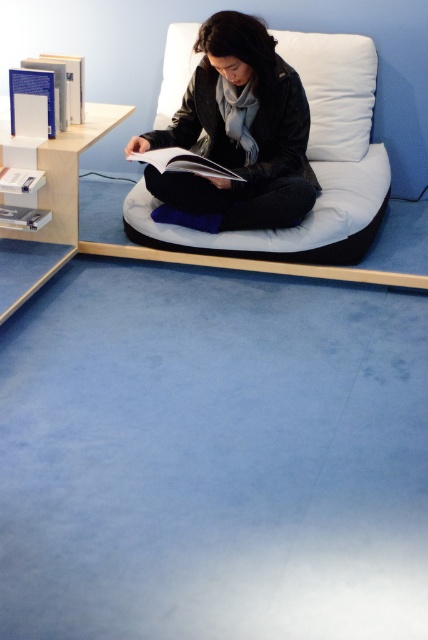
You are organizing a bookshelf and want to place the blue hardcover book at upper left and the white paper book at left. Which book should you place first if you want to arrange them from tallest to shortest?

You should place the blue hardcover book at upper left first because it is much taller than the white paper book at left.

You are sitting on the white soft cushion at center and want to place the white paper book at center on your lap. Considering their sizes, will the book fit comfortably on the cushion?

The white soft cushion at center is bigger than the white paper book at center, so the book will fit comfortably on the cushion.

You are standing in the room and want to place a new book on the shelf. The shelf has a coordinate system where the bottom left corner is at point 0.0 and the top right corner is at point 1.0. The blue hardcover book at upper left is located at point (64, 84). Where should you place the new book so that it is to the right of the blue hardcover book at upper left?

To place the new book to the right of the blue hardcover book at upper left, you should position it at a coordinate with an x value greater than 0.133 and a y value around 0.150, ensuring it remains on the shelf within the 0.0 to 1.0 coordinate system.